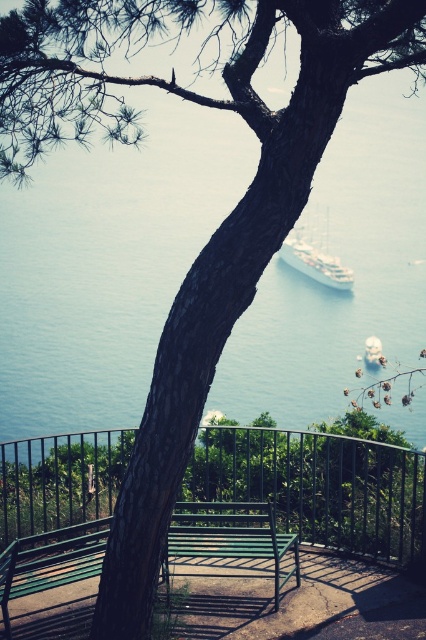
Question: Where is green metal fence at center located in relation to green metal bench at lower left in the image?

Choices:
 (A) below
 (B) above

Answer: (B)

Question: Which point appears closest to the camera in this image?

Choices:
 (A) (195, 512)
 (B) (314, 275)
 (C) (17, 458)

Answer: (C)

Question: Is green metal fence at center to the left of green metal bench at center from the viewer's perspective?

Choices:
 (A) yes
 (B) no

Answer: (B)

Question: Is green metal fence at center below green metal bench at center?

Choices:
 (A) yes
 (B) no

Answer: (B)

Question: Which point is closer to the camera?

Choices:
 (A) (216, 524)
 (B) (322, 269)

Answer: (A)

Question: Among these objects, which one is nearest to the camera?

Choices:
 (A) green metal bench at lower left
 (B) white glossy ship at center
 (C) green metal bench at center

Answer: (A)